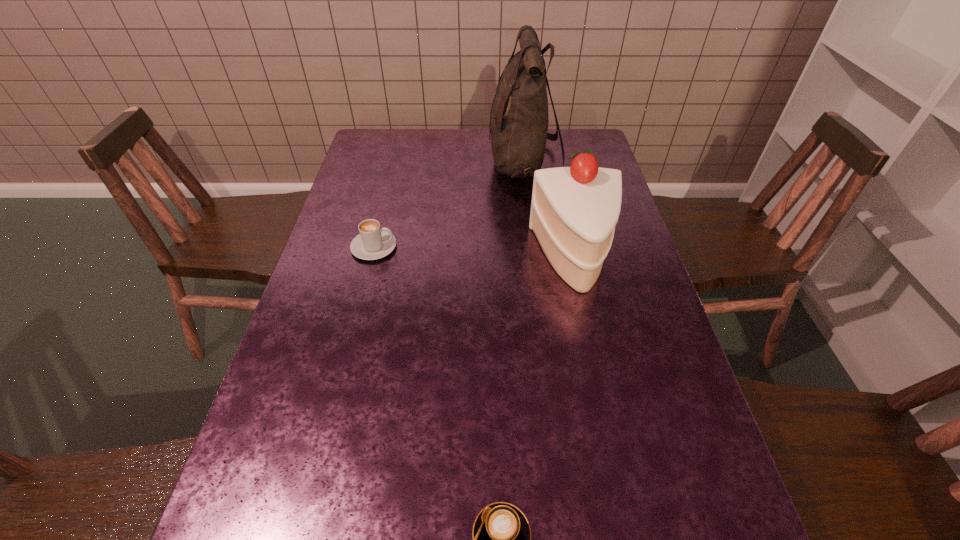
I want to click on the farthest object, so click(519, 121).

At what (x,y) coordinates should I click in order to perform the action: click on the tallest object. Please return your answer as a coordinate pair (x, y). This screenshot has height=540, width=960. Looking at the image, I should click on (519, 121).

Identify the location of cake. The image size is (960, 540). (574, 210).

Image resolution: width=960 pixels, height=540 pixels. Find the location of `the leftmost object`. the leftmost object is located at coordinates (373, 242).

The height and width of the screenshot is (540, 960). Find the location of `the farther cappuccino`. the farther cappuccino is located at coordinates (373, 242).

Where is `vacant space located on the open flap of the backpack`? Image resolution: width=960 pixels, height=540 pixels. vacant space located on the open flap of the backpack is located at coordinates (382, 164).

Locate an element on the screen. This screenshot has height=540, width=960. free space located 0.130m on the open flap of the backpack is located at coordinates (450, 164).

Where is `vacant space situated 0.230m on the open flap of the backpack`? The image size is (960, 540). vacant space situated 0.230m on the open flap of the backpack is located at coordinates (420, 164).

This screenshot has height=540, width=960. What are the coordinates of `vacant space located on the front of the third shortest object` in the screenshot? It's located at (604, 391).

The width and height of the screenshot is (960, 540). Find the location of `vacant region located 0.120m to the right of the left cappuccino`. vacant region located 0.120m to the right of the left cappuccino is located at coordinates (441, 247).